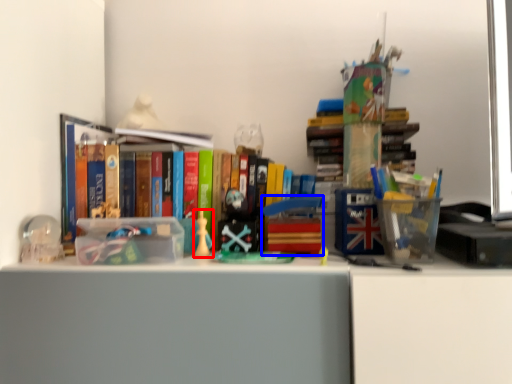
Question: Which object is further to the camera taking this photo, toy (highlighted by a red box) or toy (highlighted by a blue box)?

Choices:
 (A) toy
 (B) toy

Answer: (A)